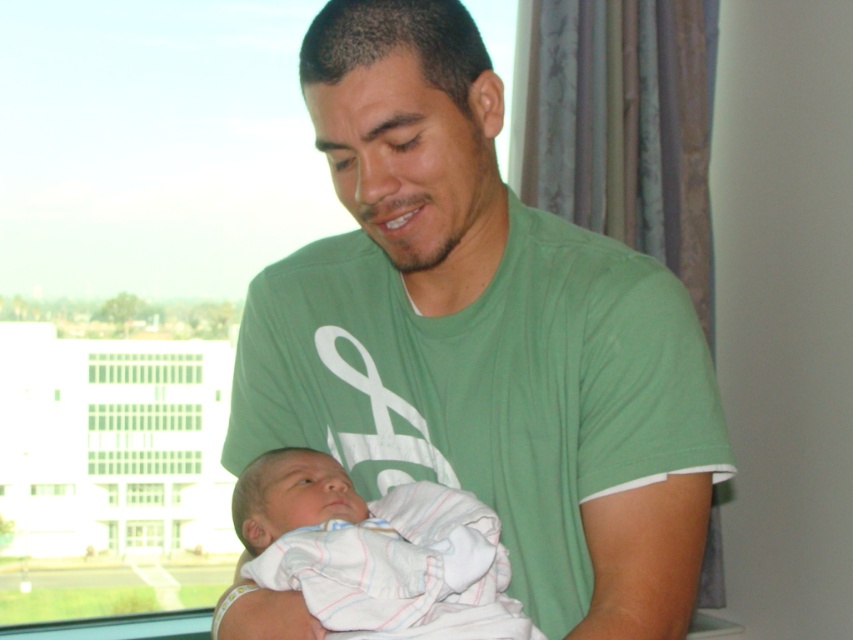
You are a nurse in a hospital room. You need to check the baby wrapped in the white striped cloth at center. Is the green cotton shirt at center blocking your view of the baby?

The green cotton shirt at center is positioned over the white striped cloth at center, so yes, the green cotton shirt at center is blocking the view of the baby wrapped in the white striped cloth at center.

You are a nurse in a hospital. You need to determine which item is bigger between the green cotton shirt at center and the white striped cloth at center. Which one is larger?

The green cotton shirt at center is larger in size than the white striped cloth at center.

You are a photographer setting up for a family photo. You notice the green cotton shirt at center and the white striped cloth at center in the scene. Which object should you adjust to ensure both are fully visible in the frame?

The green cotton shirt at center is taller than the white striped cloth at center. To ensure both are fully visible in the frame, you should adjust the white striped cloth at center to a lower position so it doesn